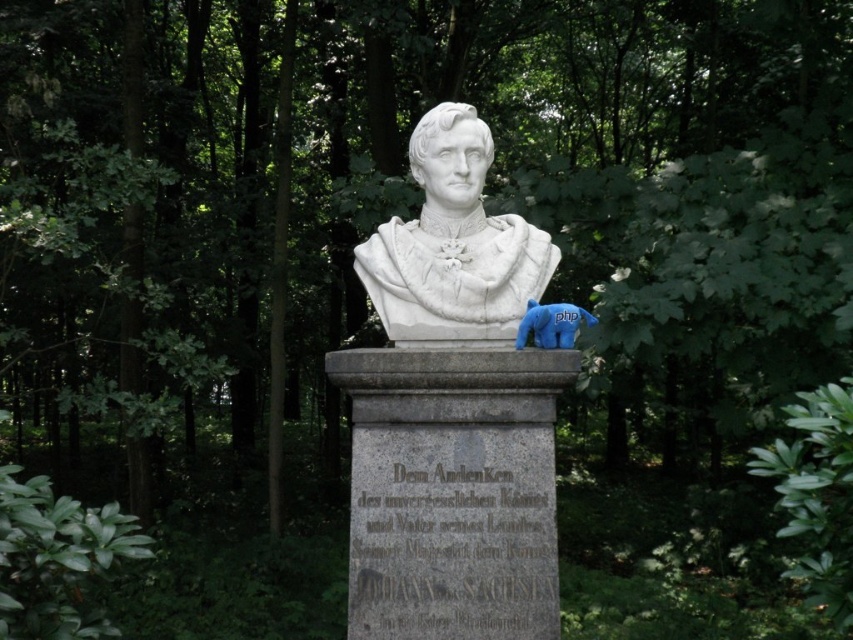
Is point (466, 280) positioned in front of point (572, 337)?

That is False.

Is white marble bust at center shorter than blue plush bear at center?

No.

Which is in front, point (438, 125) or point (520, 337)?

Positioned in front is point (520, 337).

The height and width of the screenshot is (640, 853). I want to click on white marble bust at center, so click(x=453, y=246).